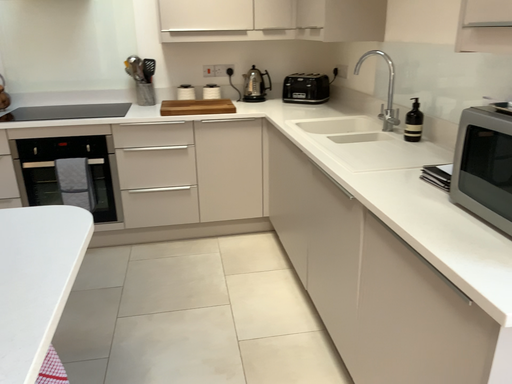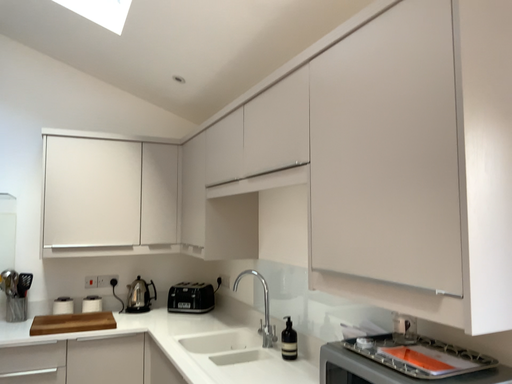
Question: How did the camera likely rotate when shooting the video?

Choices:
 (A) rotated right
 (B) rotated left

Answer: (A)